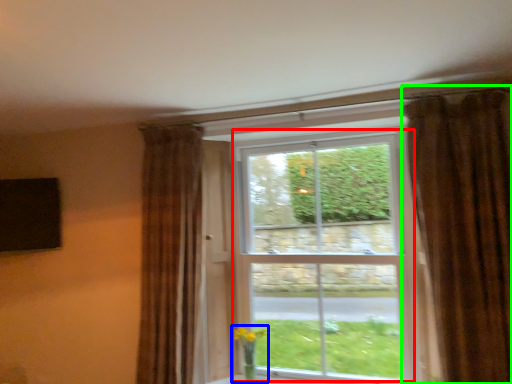
Question: Estimate the real-world distances between objects in this image. Which object is closer to bay window (highlighted by a red box), floral arrangement (highlighted by a blue box) or curtain (highlighted by a green box)?

Choices:
 (A) floral arrangement
 (B) curtain

Answer: (B)